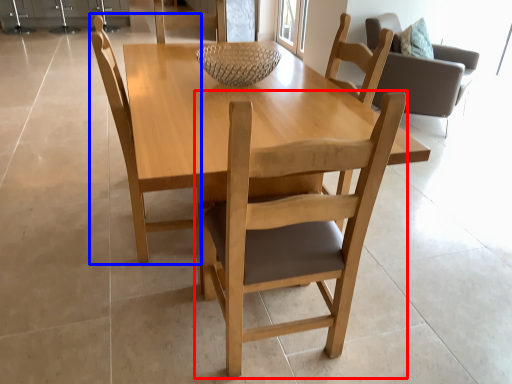
Question: Which point is closer to the camera, chair (highlighted by a red box) or chair (highlighted by a blue box)?

Choices:
 (A) chair
 (B) chair

Answer: (A)